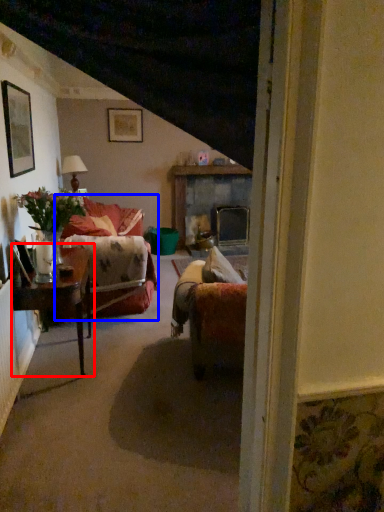
Question: Which point is further to the camera, table (highlighted by a red box) or couch (highlighted by a blue box)?

Choices:
 (A) table
 (B) couch

Answer: (B)